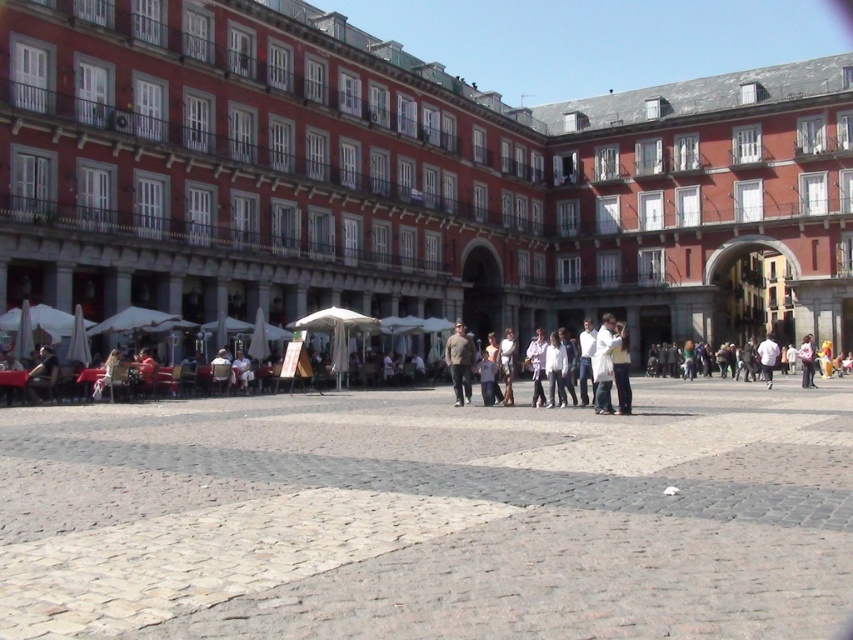
Looking at this image, you are standing in the plaza and want to take a photo of the red brick building at center and the white cotton shirt at center. Which object should you focus on first if you want to capture both in one frame without moving the camera?

You should focus on the white cotton shirt at center first because the red brick building at center is positioned to the right of it, so by centering the white cotton shirt, you can include both in the frame without moving the camera.